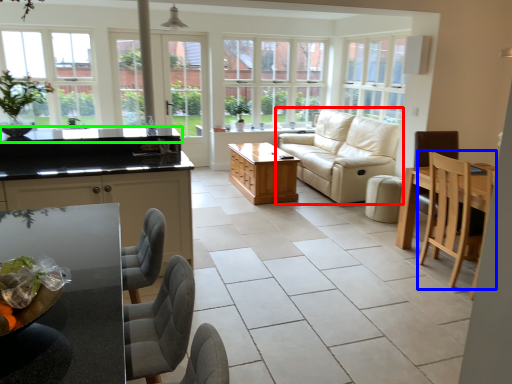
Question: Which is nearer to the studio couch (highlighted by a red box)? chair (highlighted by a blue box) or countertop (highlighted by a green box).

Choices:
 (A) chair
 (B) countertop

Answer: (A)